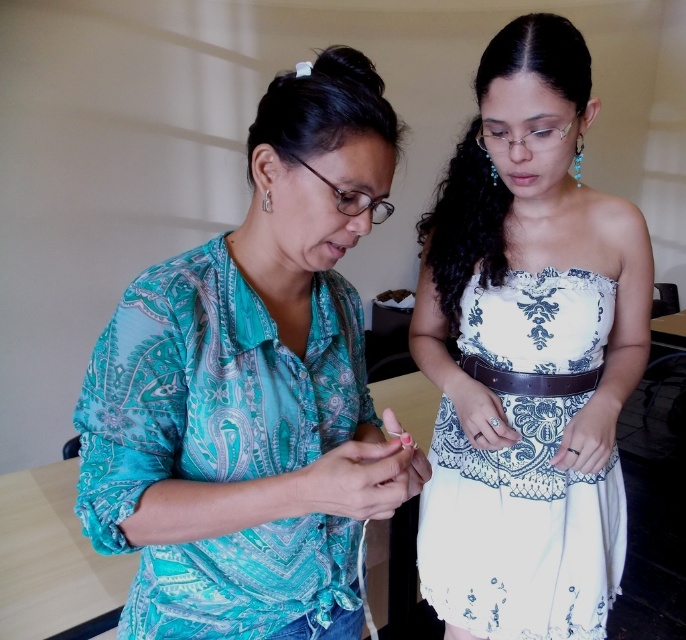
You are designing a virtual fitting room and need to determine the relative sizes of the items. Which item in the image takes up more visual space, the white lace dress at center or the silver metallic earring at upper left?

The white lace dress at center has a larger size compared to the silver metallic earring at upper left, so the white lace dress at center takes up more visual space.

You are standing in front of the two people in the image. Which of the two points, point (486, 484) or point (265, 196), is closer to you?

Point (486, 484) is closer to you because it is further to the viewer than point (265, 196).

You are a fashion designer observing two outfits in the image. The teal printed blouse at left and the white lace dress at center. Which outfit has a smaller width?

The teal printed blouse at left has a smaller width than the white lace dress at center.